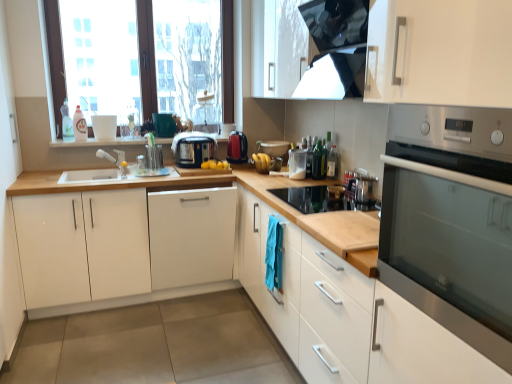
Question: Is green glass bottle at center, arranged as the second bottle when viewed from the back, touching black plastic toaster at center, positioned as the 1th kitchen appliance in left-to-right order?

Choices:
 (A) yes
 (B) no

Answer: (B)

Question: Is green glass bottle at center, the 2th bottle viewed from the left, at the right side of black plastic toaster at center, positioned as the 1th kitchen appliance in left-to-right order?

Choices:
 (A) yes
 (B) no

Answer: (A)

Question: From the image's perspective, is green glass bottle at center, the second bottle from the right, over black plastic toaster at center, positioned as the 1th kitchen appliance in left-to-right order?

Choices:
 (A) yes
 (B) no

Answer: (B)

Question: From the image's perspective, is green glass bottle at center, the 2th bottle viewed from the left, beneath black plastic toaster at center, the second kitchen appliance viewed from the right?

Choices:
 (A) yes
 (B) no

Answer: (A)

Question: Could you tell me if green glass bottle at center, which appears as the 2th bottle when viewed from the front, is facing black plastic toaster at center, positioned as the 1th kitchen appliance in left-to-right order?

Choices:
 (A) no
 (B) yes

Answer: (A)

Question: Considering their positions, is satin silver toaster at upper right, which is the 3th appliance from back to front, located in front of or behind transparent plastic bottle at upper right, the third bottle positioned from the back?

Choices:
 (A) front
 (B) behind

Answer: (A)

Question: From a real-world perspective, is satin silver toaster at upper right, which ranks as the third appliance in top-to-bottom order, above or below transparent plastic bottle at upper right, the third bottle positioned from the back?

Choices:
 (A) below
 (B) above

Answer: (A)

Question: Is satin silver toaster at upper right, the first appliance from the right, inside or outside of transparent plastic bottle at upper right, which appears as the 1th bottle when viewed from the front?

Choices:
 (A) outside
 (B) inside

Answer: (A)

Question: In terms of height, does satin silver toaster at upper right, which ranks as the third appliance in top-to-bottom order, look taller or shorter compared to transparent plastic bottle at upper right, which appears as the 1th bottle when viewed from the front?

Choices:
 (A) tall
 (B) short

Answer: (B)

Question: Is point (371, 180) closer or farther from the camera than point (376, 352)?

Choices:
 (A) farther
 (B) closer

Answer: (A)

Question: Considering the relative positions of satin silver toaster at upper right, which ranks as the third appliance in top-to-bottom order, and wooden cutting board at center in the image provided, is satin silver toaster at upper right, which ranks as the third appliance in top-to-bottom order, to the left or to the right of wooden cutting board at center?

Choices:
 (A) right
 (B) left

Answer: (A)

Question: Which is correct: satin silver toaster at upper right, which ranks as the third appliance in top-to-bottom order, is inside wooden cutting board at center, or outside of it?

Choices:
 (A) outside
 (B) inside

Answer: (A)

Question: From the image's perspective, is satin silver toaster at upper right, the first appliance from the right, located above or below wooden cutting board at center?

Choices:
 (A) above
 (B) below

Answer: (A)

Question: Would you say green glass bottle at center, arranged as the second bottle when viewed from the back, is to the left or to the right of translucent plastic bottle at upper left, the 1th bottle when ordered from left to right, in the picture?

Choices:
 (A) left
 (B) right

Answer: (B)

Question: Considering their positions, is green glass bottle at center, which appears as the 2th bottle when viewed from the front, located in front of or behind translucent plastic bottle at upper left, which is the third bottle from front to back?

Choices:
 (A) behind
 (B) front

Answer: (B)